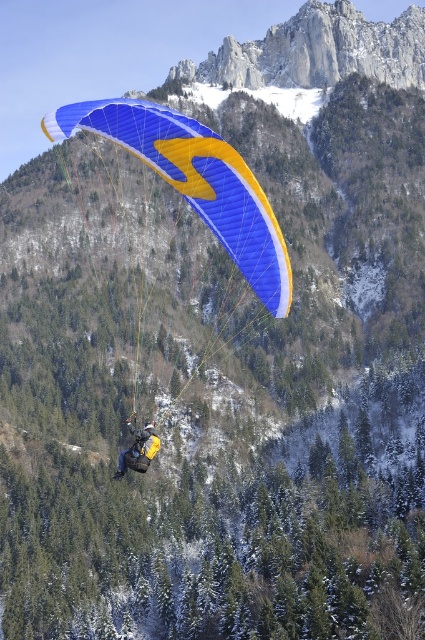
Measure the distance between blue fabric parachute at center and camera.

blue fabric parachute at center is 48.11 meters away from camera.

Looking at this image, is blue fabric parachute at center to the left of yellow fabric parachute at center from the viewer's perspective?

Correct, you'll find blue fabric parachute at center to the left of yellow fabric parachute at center.

Image resolution: width=425 pixels, height=640 pixels. What are the coordinates of `blue fabric parachute at center` in the screenshot? It's located at (195, 182).

The image size is (425, 640). Identify the location of blue fabric parachute at center. (195, 182).